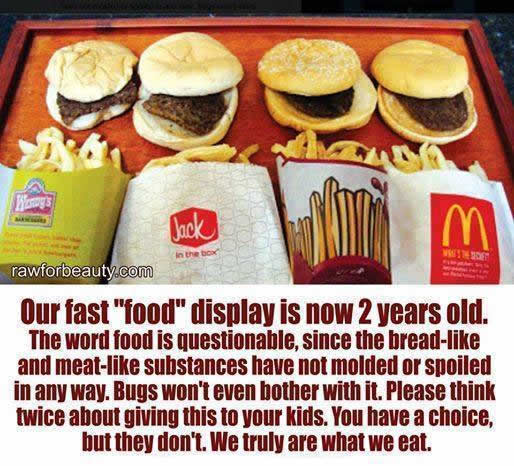
The width and height of the screenshot is (514, 466). In order to click on tray in this screenshot , I will do `click(245, 37)`.